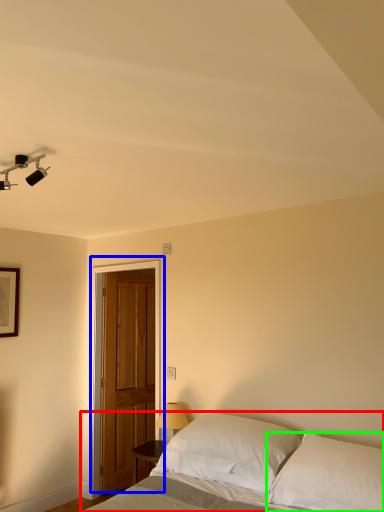
Question: Considering the real-world distances, which object is closest to bed (highlighted by a red box)? door (highlighted by a blue box) or pillow (highlighted by a green box).

Choices:
 (A) door
 (B) pillow

Answer: (B)